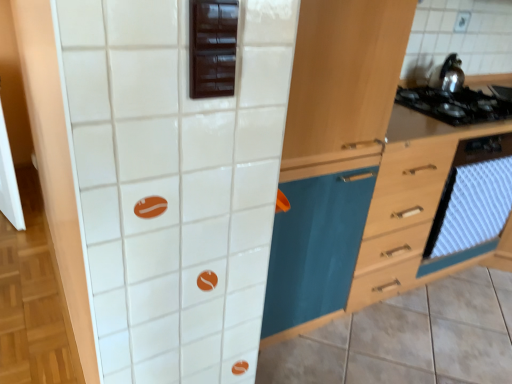
Question: Is white textured oven at right completely or partially inside wooden drawer at right?

Choices:
 (A) yes
 (B) no

Answer: (A)

Question: Is wooden drawer at right positioned with its back to white textured oven at right?

Choices:
 (A) yes
 (B) no

Answer: (A)

Question: Is wooden drawer at right in contact with white textured oven at right?

Choices:
 (A) no
 (B) yes

Answer: (A)

Question: Is wooden drawer at right far from white textured oven at right?

Choices:
 (A) no
 (B) yes

Answer: (A)

Question: Is wooden drawer at right shorter than white textured oven at right?

Choices:
 (A) yes
 (B) no

Answer: (B)

Question: From the image's perspective, is wooden drawer at right positioned above or below black glass stove at upper right?

Choices:
 (A) above
 (B) below

Answer: (B)

Question: From a real-world perspective, is wooden drawer at right positioned above or below black glass stove at upper right?

Choices:
 (A) above
 (B) below

Answer: (B)

Question: In terms of size, does wooden drawer at right appear bigger or smaller than black glass stove at upper right?

Choices:
 (A) small
 (B) big

Answer: (B)

Question: Is point (388, 201) positioned closer to the camera than point (504, 127)?

Choices:
 (A) closer
 (B) farther

Answer: (A)

Question: In terms of height, does white textured oven at right look taller or shorter compared to shiny metallic kettle at upper right?

Choices:
 (A) tall
 (B) short

Answer: (A)

Question: Is white textured oven at right in front of or behind shiny metallic kettle at upper right in the image?

Choices:
 (A) front
 (B) behind

Answer: (A)

Question: From the image's perspective, is white textured oven at right located above or below shiny metallic kettle at upper right?

Choices:
 (A) above
 (B) below

Answer: (B)

Question: Considering the positions of white textured oven at right and shiny metallic kettle at upper right in the image, is white textured oven at right wider or thinner than shiny metallic kettle at upper right?

Choices:
 (A) wide
 (B) thin

Answer: (B)

Question: In terms of height, does dark brown wooden cabinet at upper center look taller or shorter compared to shiny metallic kettle at upper right?

Choices:
 (A) tall
 (B) short

Answer: (B)

Question: Is dark brown wooden cabinet at upper center bigger or smaller than shiny metallic kettle at upper right?

Choices:
 (A) small
 (B) big

Answer: (A)